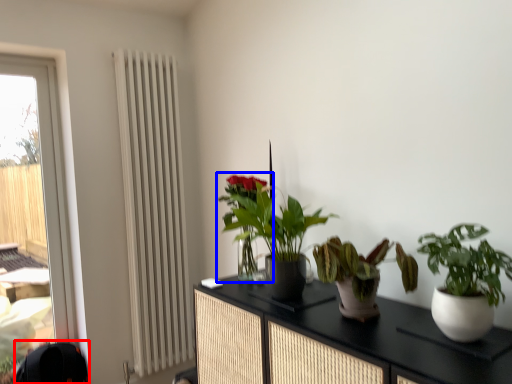
Question: Which point is closer to the camera, swivel chair (highlighted by a red box) or houseplant (highlighted by a blue box)?

Choices:
 (A) swivel chair
 (B) houseplant

Answer: (B)